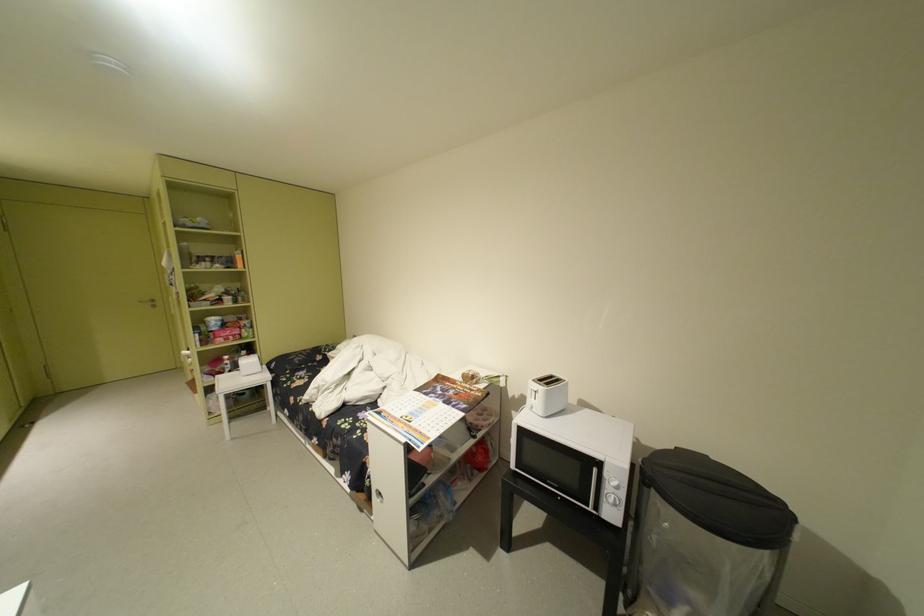
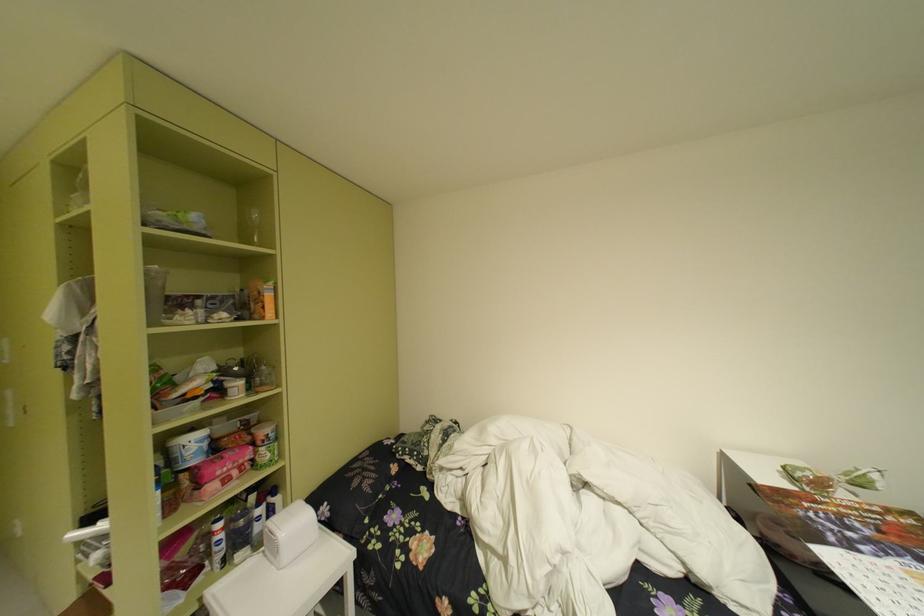
Locate, in the second image, the point that corresponds to pixel 238 360 in the first image.

(235, 528)